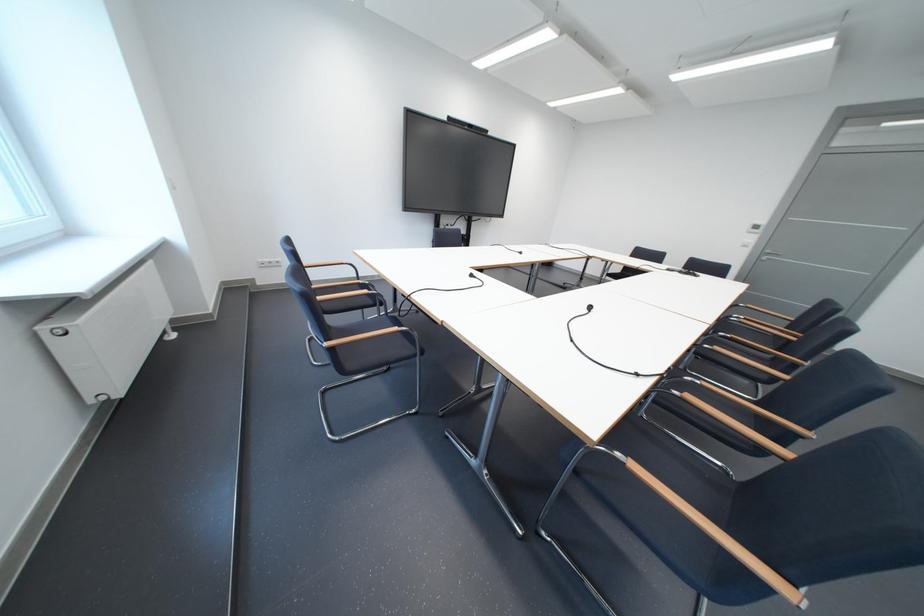
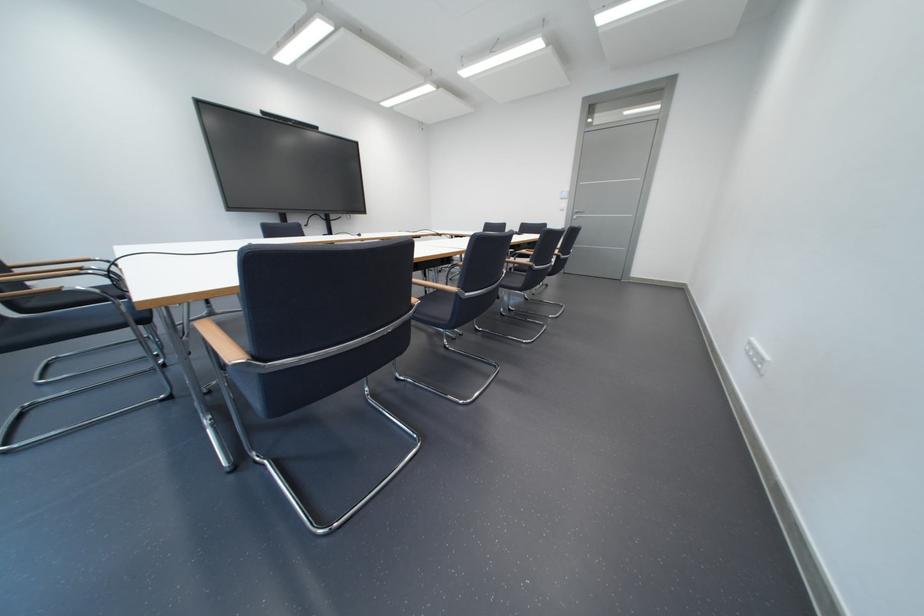
Question: Which direction would the cameraman need to move to produce the second image? Reply with the corresponding letter.

Choices:
 (A) Left
 (B) Right
 (C) Forward
 (D) Backward

Answer: (B)